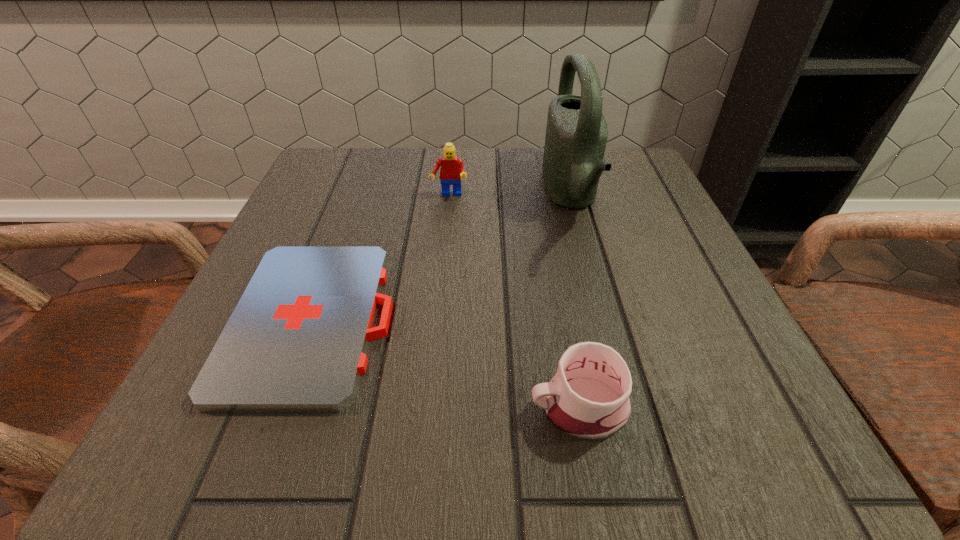
This screenshot has width=960, height=540. I want to click on object situated at the near left corner, so click(x=296, y=341).

Identify the location of object that is at the far right corner. This screenshot has height=540, width=960. (576, 134).

At what (x,y) coordinates should I click in order to perform the action: click on free space at the far edge of the desktop. Please return your answer as a coordinate pair (x, y). Looking at the image, I should click on (434, 186).

In the image, there is a desktop. Identify the location of free region at the near edge. (635, 432).

The image size is (960, 540). Identify the location of vacant point at the left edge. (323, 245).

This screenshot has width=960, height=540. In the image, there is a desktop. Identify the location of vacant region at the right edge. (739, 333).

The image size is (960, 540). In the image, there is a desktop. Find the location of `free space at the far left corner`. free space at the far left corner is located at coordinates (345, 187).

In the image, there is a desktop. Where is `vacant space at the near left corner`? vacant space at the near left corner is located at coordinates (288, 461).

Locate an element on the screen. The image size is (960, 540). free space at the far right corner of the desktop is located at coordinates (645, 190).

The height and width of the screenshot is (540, 960). What are the coordinates of `free region at the near right corner of the desktop` in the screenshot? It's located at (709, 454).